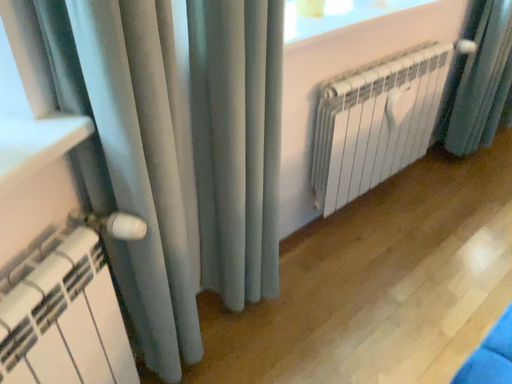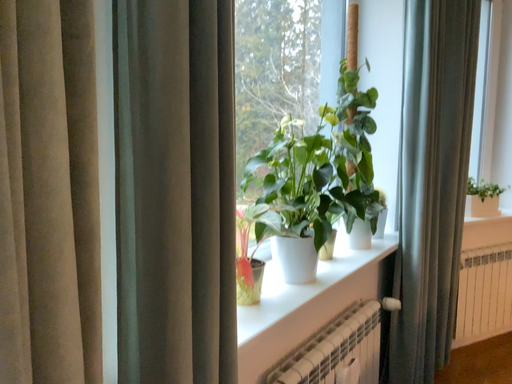
Question: Which way did the camera rotate in the video?

Choices:
 (A) rotated left
 (B) rotated right

Answer: (B)